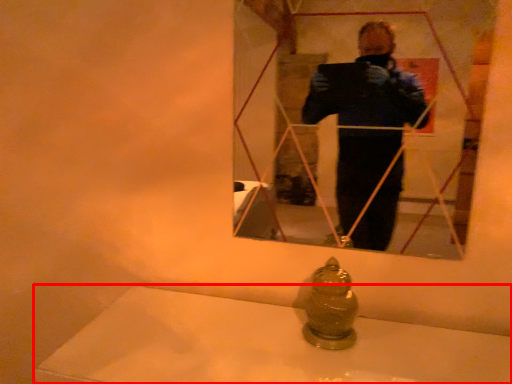
Question: From the image's perspective, what is the correct spatial relationship of bath (annotated by the red box) in relation to mirror?

Choices:
 (A) above
 (B) below

Answer: (B)